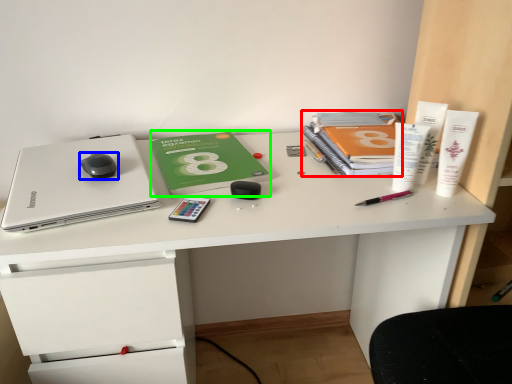
Question: Which is farther away from paperback book (highlighted by a red box)? mouse (highlighted by a blue box) or paperback book (highlighted by a green box)?

Choices:
 (A) mouse
 (B) paperback book

Answer: (A)